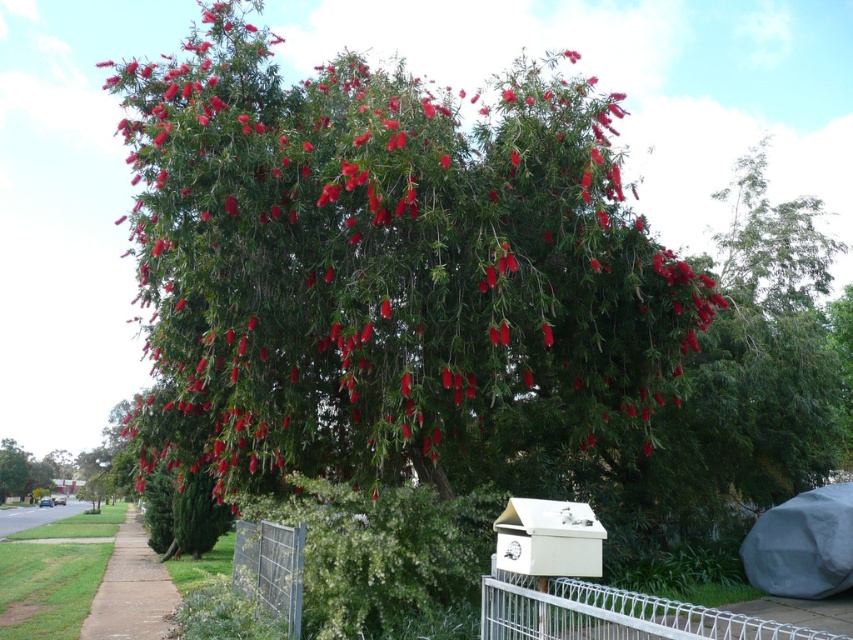
You are a mail carrier trying to deliver a letter to the mailbox. You notice the red glossy flowers at center and the white wire mesh at lower center. Which object is closer to the ground?

The white wire mesh at lower center is closer to the ground because the red glossy flowers at center are located above it.

You are a mail carrier trying to deliver a letter to the mailbox. You are standing on the brown asphalt at lower left and see the white wire mesh at lower center. Which direction should you move to reach the mailbox?

The white wire mesh at lower center is to the right of the brown asphalt at lower left, so you should move to the right to reach the mailbox.

You are standing at the camera position looking at the scene. There is a point marked at coordinates point (614,364). Can you reach that point by walking straight ahead without moving sideways?

The point (614,364) is 7.28 meters away from the camera. Since it is a coordinate in the scene, you can walk straight ahead towards it as there are no obstacles mentioned blocking the path. However, the exact reachability depends on the terrain and any potential barriers not described here.